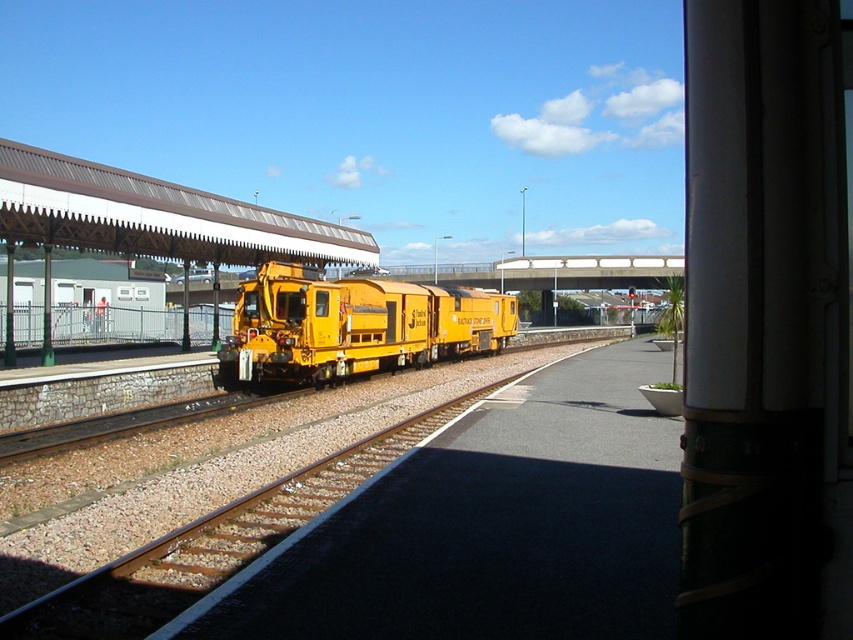
You are a maintenance worker needing to inspect the yellow metal train track at center and the yellow matte train at center. Given that your tool box is 1.5 meters long, can you safely place it between them without it extending beyond either object?

The yellow metal train track at center and yellow matte train at center are 10.92 meters apart. Since your tool box is only 1.5 meters long, you can safely place it between them as there is enough space.

You are a maintenance worker checking the railway station. You need to determine if the yellow metal train track at center is higher or lower than the yellow matte train at center. Based on the scene, what is your observation?

The yellow metal train track at center has a lesser height compared to the yellow matte train at center, so the track is lower than the train.